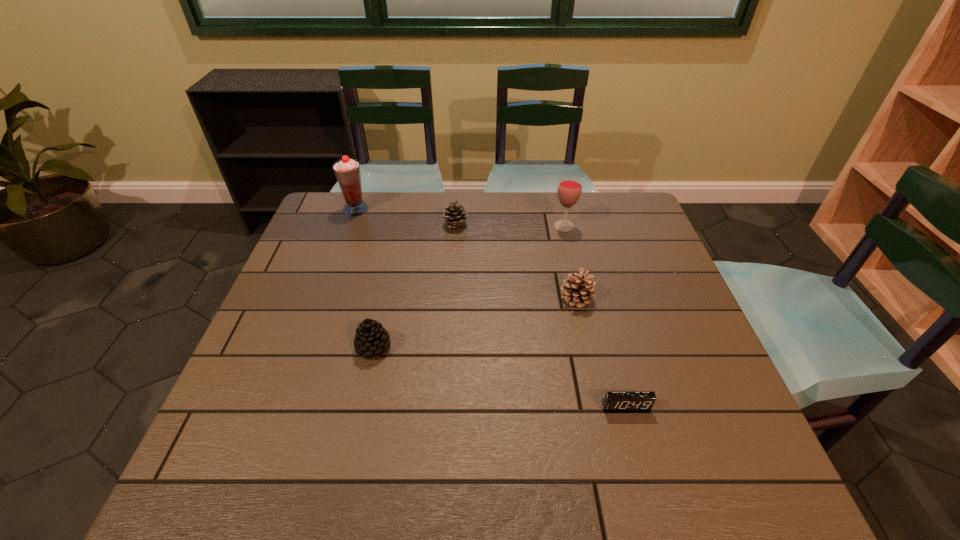
Identify the location of object situated at the left edge. The width and height of the screenshot is (960, 540). (347, 171).

This screenshot has width=960, height=540. In order to click on object at the far left corner in this screenshot , I will do `click(347, 171)`.

Where is `vacant position at the far edge of the desktop`? vacant position at the far edge of the desktop is located at coordinates (471, 219).

Image resolution: width=960 pixels, height=540 pixels. In the image, there is a desktop. Find the location of `vacant space at the left edge`. vacant space at the left edge is located at coordinates (341, 286).

In the image, there is a desktop. Identify the location of vacant region at the right edge. (666, 295).

Locate an element on the screen. This screenshot has width=960, height=540. free space at the far left corner of the desktop is located at coordinates (341, 225).

In the image, there is a desktop. Where is `vacant space at the far right corner`? vacant space at the far right corner is located at coordinates (619, 210).

Locate an element on the screen. Image resolution: width=960 pixels, height=540 pixels. empty space that is in between the alarm clock and the tallest object is located at coordinates (491, 308).

Find the location of a particular element. blank region between the nearest object and the second nearest pinecone is located at coordinates (601, 352).

What are the coordinates of `vacant area that lies between the leftmost object and the second nearest object` in the screenshot? It's located at (365, 278).